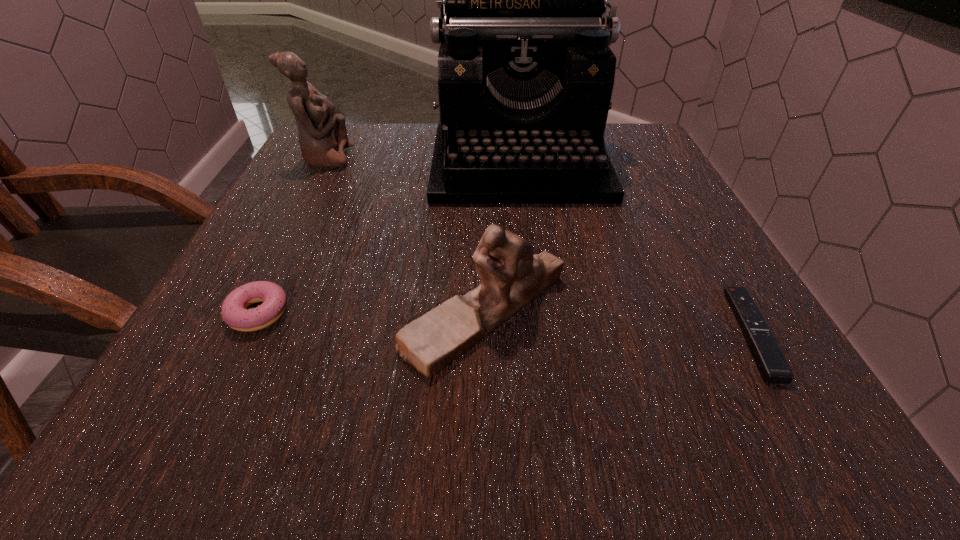
Locate an element on the screen. The width and height of the screenshot is (960, 540). typewriter is located at coordinates (525, 74).

The height and width of the screenshot is (540, 960). I want to click on the left figurine, so click(x=323, y=137).

Identify the location of the farther figurine. The image size is (960, 540). (323, 137).

Image resolution: width=960 pixels, height=540 pixels. In order to click on the right figurine in this screenshot , I will do `click(511, 276)`.

What are the coordinates of `the third shortest object` in the screenshot? It's located at (511, 276).

Locate an element on the screen. the fourth tallest object is located at coordinates click(x=235, y=314).

The image size is (960, 540). I want to click on the shortest object, so click(773, 367).

Find the location of a particular element. The height and width of the screenshot is (540, 960). remote control is located at coordinates (773, 367).

I want to click on free space located on the typing side of the typewriter, so click(540, 315).

Where is `free space located on the front-facing side of the farther figurine`? The width and height of the screenshot is (960, 540). free space located on the front-facing side of the farther figurine is located at coordinates pos(493,158).